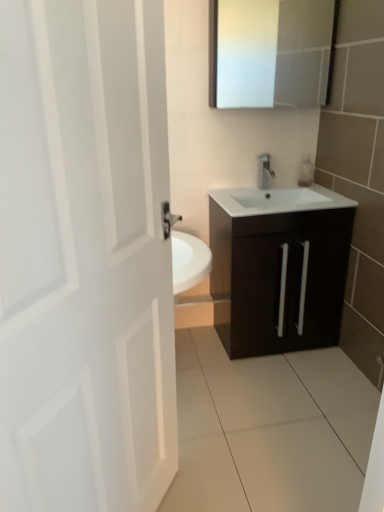
Image resolution: width=384 pixels, height=512 pixels. What do you see at coordinates (85, 258) in the screenshot?
I see `white matte door at left` at bounding box center [85, 258].

What is the approximate width of white matte door at left?

It is 5.89 inches.

What do you see at coordinates (271, 52) in the screenshot?
I see `white glossy medicine cabinet at upper center` at bounding box center [271, 52].

What do you see at coordinates (278, 267) in the screenshot? The height and width of the screenshot is (512, 384). I see `matte dark brown cabinet at center` at bounding box center [278, 267].

What do you see at coordinates (264, 170) in the screenshot? I see `satin nickel faucet at center` at bounding box center [264, 170].

Identify the location of white matte door at left. (85, 258).

Is matte dark brown cabinet at center to the left of white matte door at left from the viewer's perspective?

No, matte dark brown cabinet at center is not to the left of white matte door at left.

Does matte dark brown cabinet at center lie behind white matte door at left?

Yes, it is behind white matte door at left.

How different are the orientations of matte dark brown cabinet at center and white matte door at left in degrees?

The facing directions of matte dark brown cabinet at center and white matte door at left are 53.6 degrees apart.

Does matte dark brown cabinet at center have a lesser width compared to white matte door at left?

No, matte dark brown cabinet at center is not thinner than white matte door at left.

Who is taller, white matte door at left or matte dark brown cabinet at center?

Standing taller between the two is white matte door at left.

Does point (56, 508) come behind point (271, 252)?

No, (56, 508) is in front of (271, 252).

Based on the photo, does white matte door at left have a smaller size compared to matte dark brown cabinet at center?

Correct, white matte door at left occupies less space than matte dark brown cabinet at center.

Considering the sizes of objects satin nickel faucet at center and white glossy medicine cabinet at upper center in the image provided, who is bigger, satin nickel faucet at center or white glossy medicine cabinet at upper center?

With larger size is white glossy medicine cabinet at upper center.

Which of these two, satin nickel faucet at center or white glossy medicine cabinet at upper center, stands taller?

white glossy medicine cabinet at upper center.

From the image's perspective, does satin nickel faucet at center appear higher than white glossy medicine cabinet at upper center?

No, from the image's perspective, satin nickel faucet at center is not over white glossy medicine cabinet at upper center.

Is the depth of satin nickel faucet at center greater than that of white glossy medicine cabinet at upper center?

That is True.

From the picture: Is white glossy medicine cabinet at upper center inside the boundaries of matte dark brown cabinet at center, or outside?

white glossy medicine cabinet at upper center is not inside matte dark brown cabinet at center, it's outside.

Based on the photo, does white glossy medicine cabinet at upper center appear on the right side of matte dark brown cabinet at center?

No, white glossy medicine cabinet at upper center is not to the right of matte dark brown cabinet at center.

Can you confirm if white glossy medicine cabinet at upper center is wider than matte dark brown cabinet at center?

Incorrect, the width of white glossy medicine cabinet at upper center does not surpass that of matte dark brown cabinet at center.

Measure the distance from white glossy medicine cabinet at upper center to matte dark brown cabinet at center.

white glossy medicine cabinet at upper center is 38.51 inches away from matte dark brown cabinet at center.

Considering their positions, is white matte door at left located in front of or behind satin nickel faucet at center?

white matte door at left is positioned closer to the viewer than satin nickel faucet at center.

From the image's perspective, does white matte door at left appear higher than satin nickel faucet at center?

No, from the image's perspective, white matte door at left is not over satin nickel faucet at center.

Is white matte door at left taller than satin nickel faucet at center?

Yes, white matte door at left is taller than satin nickel faucet at center.

Is white matte door at left thinner than satin nickel faucet at center?

Incorrect, the width of white matte door at left is not less than that of satin nickel faucet at center.

Locate an element on the screen. The image size is (384, 512). medicine cabinet above the satin nickel faucet at center (from a real-world perspective) is located at coordinates (271, 52).

Does white glossy medicine cabinet at upper center contain satin nickel faucet at center?

No, satin nickel faucet at center is located outside of white glossy medicine cabinet at upper center.

Considering the relative sizes of white glossy medicine cabinet at upper center and satin nickel faucet at center in the image provided, is white glossy medicine cabinet at upper center wider than satin nickel faucet at center?

Correct, the width of white glossy medicine cabinet at upper center exceeds that of satin nickel faucet at center.

From a real-world perspective, which is physically above, white glossy medicine cabinet at upper center or satin nickel faucet at center?

white glossy medicine cabinet at upper center.

Consider the image. From the image's perspective, is white glossy medicine cabinet at upper center located above or below white matte door at left?

white glossy medicine cabinet at upper center is situated higher than white matte door at left in the image.

From a real-world perspective, is white glossy medicine cabinet at upper center above or below white matte door at left?

white glossy medicine cabinet at upper center is situated higher than white matte door at left in the real world.

Considering the positions of points (274, 78) and (98, 145), is point (274, 78) closer to camera compared to point (98, 145)?

No, it is behind (98, 145).

Is white glossy medicine cabinet at upper center at the right side of white matte door at left?

Correct, you'll find white glossy medicine cabinet at upper center to the right of white matte door at left.

In order to click on bathroom cabinet behind the white matte door at left in this screenshot , I will do `click(278, 267)`.

Locate an element on the screen. Image resolution: width=384 pixels, height=512 pixels. door on the left of the matte dark brown cabinet at center is located at coordinates (85, 258).

Which object lies nearer to the anchor point white glossy medicine cabinet at upper center, white matte door at left or matte dark brown cabinet at center?

The object closer to white glossy medicine cabinet at upper center is matte dark brown cabinet at center.

Based on their spatial positions, is white matte door at left or satin nickel faucet at center further from white glossy medicine cabinet at upper center?

Based on the image, white matte door at left appears to be further to white glossy medicine cabinet at upper center.

From the image, which object appears to be nearer to white matte door at left, white glossy medicine cabinet at upper center or matte dark brown cabinet at center?

matte dark brown cabinet at center lies closer to white matte door at left than the other object.

Considering their positions, is matte dark brown cabinet at center positioned closer to satin nickel faucet at center than white glossy medicine cabinet at upper center?

matte dark brown cabinet at center is positioned closer to the anchor satin nickel faucet at center.

Based on their spatial positions, is satin nickel faucet at center or white matte door at left further from matte dark brown cabinet at center?

white matte door at left is positioned further to the anchor matte dark brown cabinet at center.

Considering their positions, is satin nickel faucet at center positioned closer to white glossy medicine cabinet at upper center than matte dark brown cabinet at center?

The object closer to white glossy medicine cabinet at upper center is satin nickel faucet at center.

In the scene shown: Looking at the image, which one is located further to white matte door at left, satin nickel faucet at center or matte dark brown cabinet at center?

satin nickel faucet at center is further to white matte door at left.

Estimate the real-world distances between objects in this image. Which object is closer to matte dark brown cabinet at center, white matte door at left or white glossy medicine cabinet at upper center?

Among the two, white glossy medicine cabinet at upper center is located nearer to matte dark brown cabinet at center.

Where is `bathroom cabinet located between white matte door at left and satin nickel faucet at center in the depth direction`? bathroom cabinet located between white matte door at left and satin nickel faucet at center in the depth direction is located at coordinates (278, 267).

The width and height of the screenshot is (384, 512). I want to click on tap between white glossy medicine cabinet at upper center and matte dark brown cabinet at center vertically, so (264, 170).

Identify the location of medicine cabinet between white matte door at left and satin nickel faucet at center along the z-axis. The height and width of the screenshot is (512, 384). click(271, 52).

You are a GUI agent. You are given a task and a screenshot of the screen. Output one action in this format:
    pyautogui.click(x=<x>, y=<y>)
    Task: Click on the bathroom cabinet between white matte door at left and white glossy medicine cabinet at upper center along the z-axis
    This screenshot has height=512, width=384.
    Given the screenshot: What is the action you would take?
    pyautogui.click(x=278, y=267)